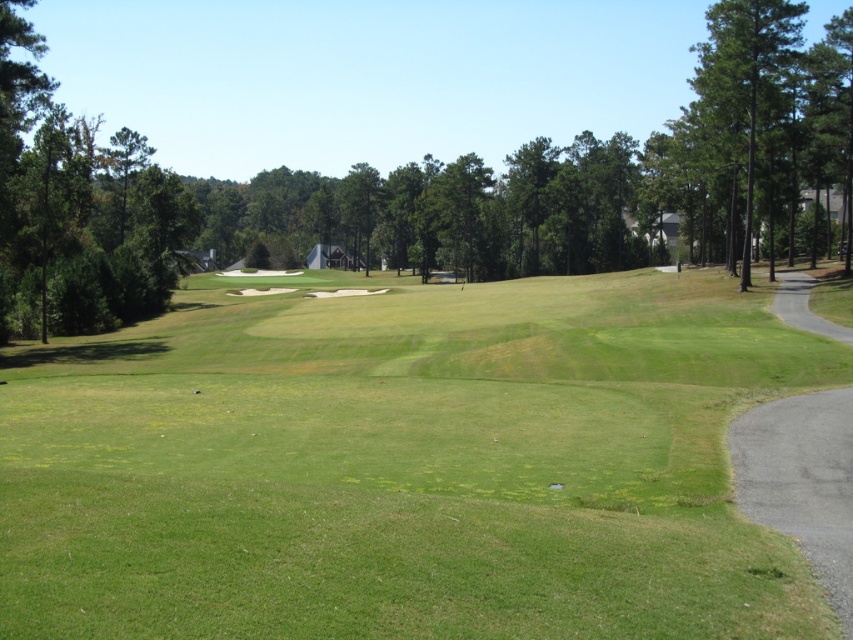
You are a golfer standing at the edge of the green grassy field at center. You want to hit a ball to a flag located 10 meters ahead. Can you reach the flag in one shot if your maximum driving distance is 8 meters?

The green grassy field at center is 5.35 meters from the viewer. Since your maximum driving distance is 8 meters and the flag is 10 meters away, you cannot reach the flag in one shot because the distance to the flag exceeds your maximum driving range.

You are a golfer standing on the sand trap in the middle of the golf course. You want to hit the ball to the green leafy tree at center. However, there is another green leafy tree at left in your path. Which tree is taller and might block your shot?

The green leafy tree at center is taller than the green leafy tree at left, so it might block your shot more than the other tree.

You are a golfer standing at the starting point on the golf course. You see a point marked at coordinates (430, 186). What object does this point correspond to?

The point corresponds to the green leafy tree at center.